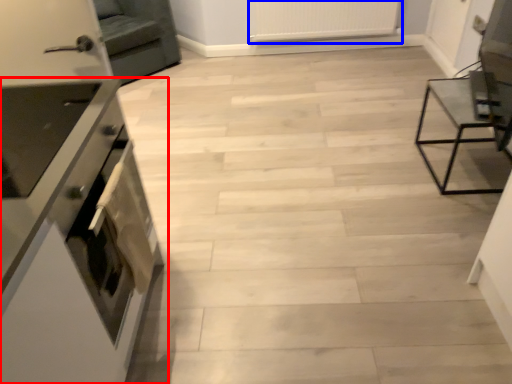
Question: Which object appears closest to the camera in this image, cabinetry (highlighted by a red box) or radiator (highlighted by a blue box)?

Choices:
 (A) cabinetry
 (B) radiator

Answer: (A)